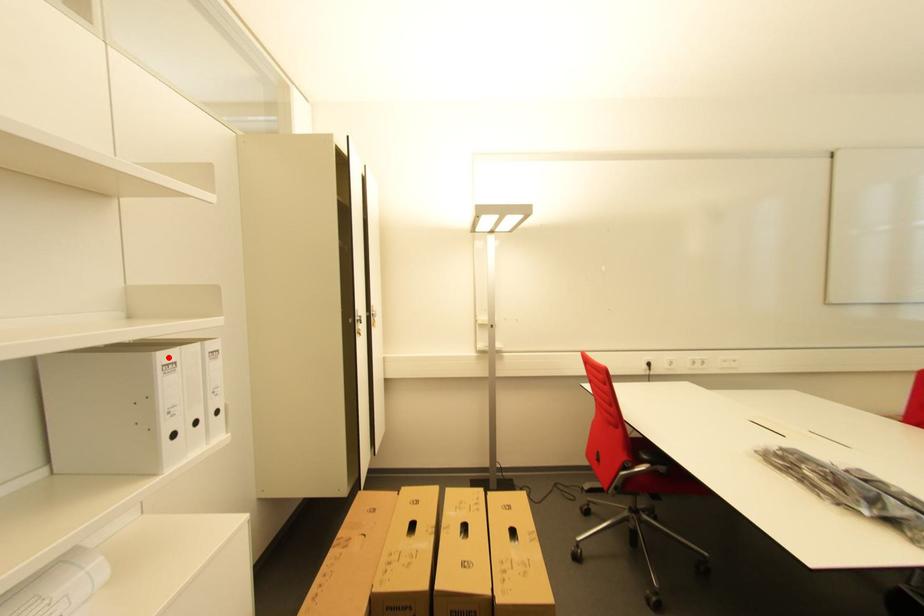
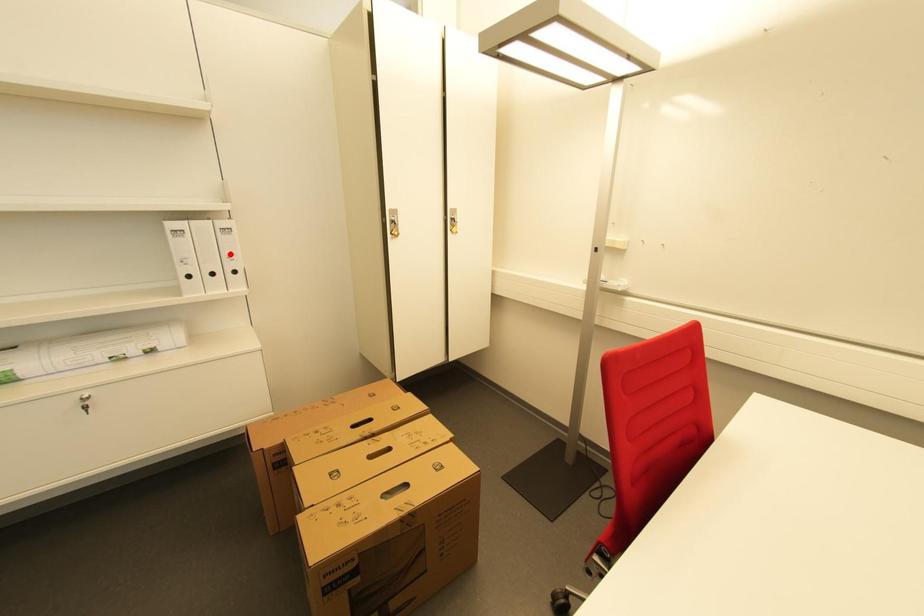
I am providing you with two images of the same scene from different viewpoints. A red point is marked on the first image and another point is marked on the second image. Is the red point in image1 aligned with the point shown in image2?

No